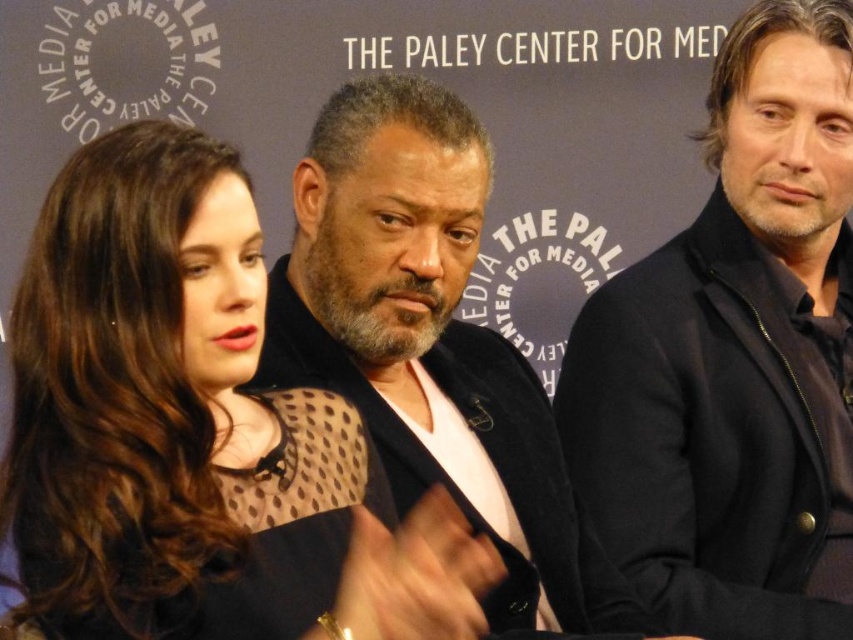
You are a photographer at the Paley Center for Media event. You need to ensure that the matte black dress at center and the black matte suit at center are both visible in the frame. Given their height difference, which one might require adjusting the camera angle to capture fully?

The matte black dress at center is taller than the black matte suit at center, so the camera angle might need to be adjusted to ensure the taller matte black dress at center is fully captured in the frame.

From the picture: You are a photographer preparing to take a group photo of the matte black dress at center and the black matte suit at center. You need to ensure that both subjects can be clearly seen in the frame. Given that the camera has a fixed width, which subject requires a wider frame to accommodate their attire?

The matte black dress at center requires a wider frame because its width surpasses that of the black matte suit at center.

You are a photographer setting up for a group photo. You have a matte black dress at center and a black wool jacket at right. Which item of clothing should you adjust to ensure there is enough space between them for proper framing?

The matte black dress at center might be wider than the black wool jacket at right, so you should adjust the position of the matte black dress at center to create more space between them.